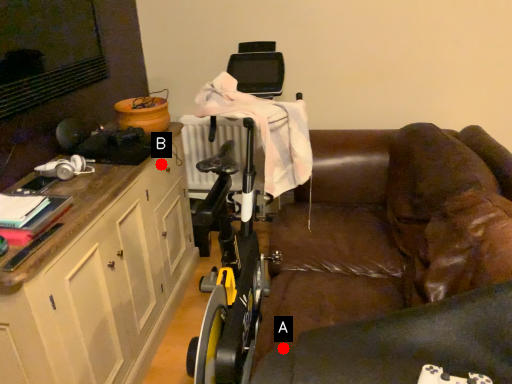
Question: Two points are circled on the image, labeled by A and B beside each circle. Among these points, which one is nearest to the camera?

Choices:
 (A) A is closer
 (B) B is closer

Answer: (A)